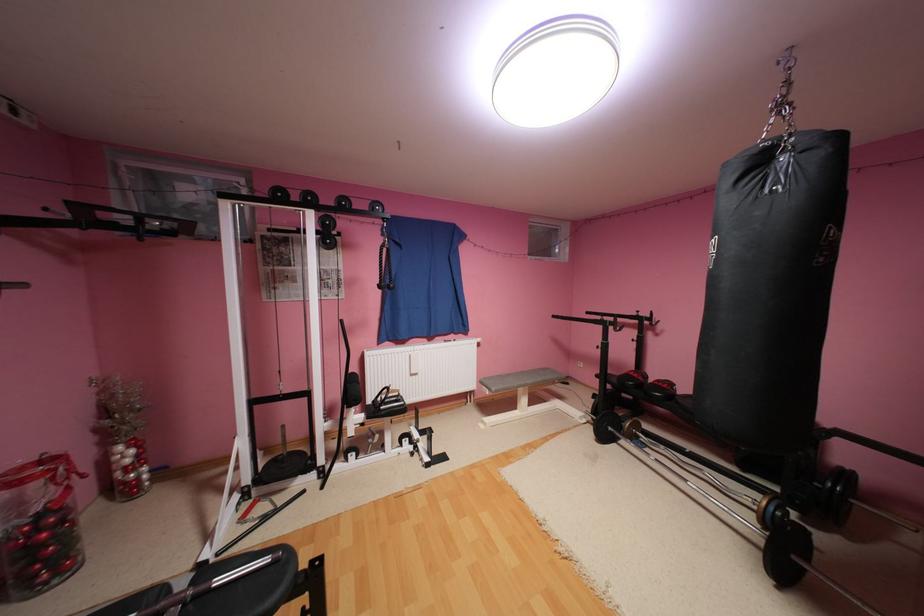
Find the location of a particular element. black rope handle is located at coordinates (344, 400).